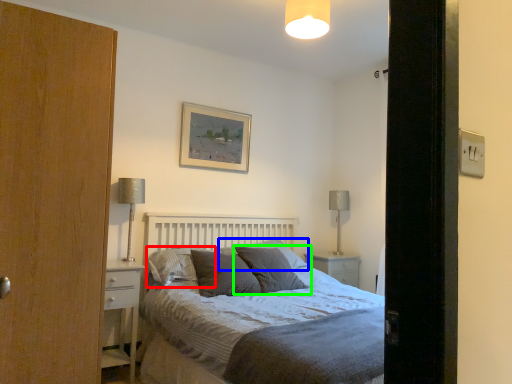
Question: Based on their relative distances, which object is farther from pillow (highlighted by a red box)? Choose from pillow (highlighted by a blue box) and pillow (highlighted by a green box).

Choices:
 (A) pillow
 (B) pillow

Answer: (A)